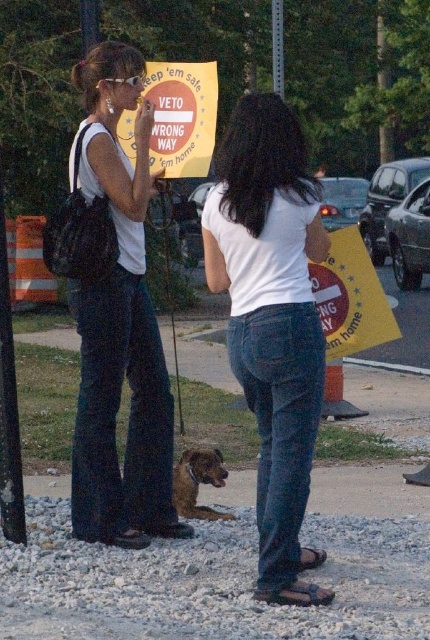
You are a delivery person who needs to attach a package to the yellow paper sign at right and the brushed metal pole at upper center. Which object can you attach the package to if the package requires a surface wider than 1 meter?

The yellow paper sign at right can hold the package because its width is larger than the brushed metal pole at upper center, and if the sign is wider than 1 meter, it meets the requirement.

You are a pedestrian trying to cross the road safely. You see the matte white tank top at center and the yellow paper sign at right. According to the sign, which direction should you go to ensure safety?

The yellow paper sign at right says to keep them safe and get them home, so you should follow the direction indicated by the yellow paper sign at right to ensure safety.

You are a delivery person who needs to place a new sign at the same location as the yellow paper sign at right. What coordinates should you use to ensure the new sign is placed correctly?

The yellow paper sign at right should be placed at coordinates point (350, 298).